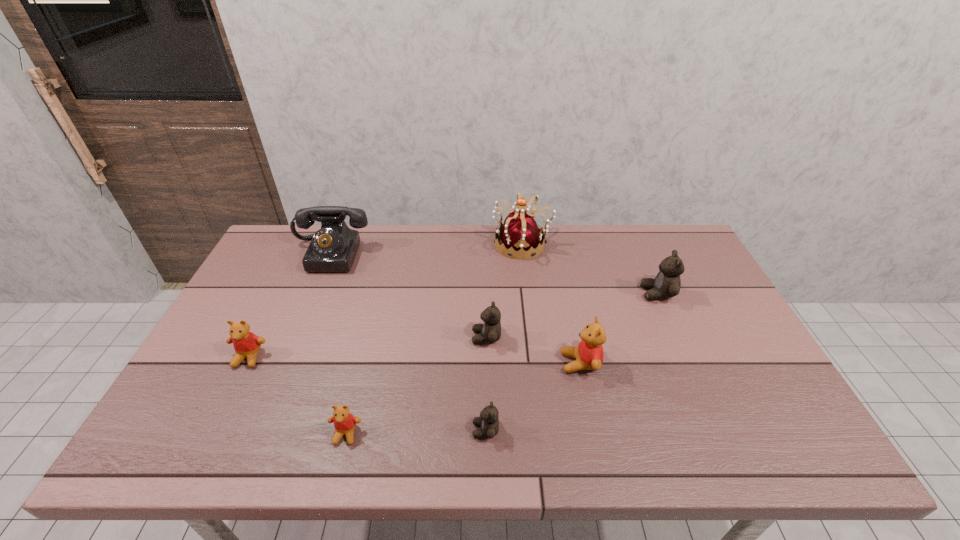
Image resolution: width=960 pixels, height=540 pixels. Identify the location of the nearest brown teddy bear. (488, 421).

Where is `the nearest red teddy bear`? This screenshot has width=960, height=540. the nearest red teddy bear is located at coordinates (344, 423).

In order to click on the smallest red teddy bear in this screenshot , I will do [x=344, y=423].

Find the location of a particular element. The width and height of the screenshot is (960, 540). vacant space located on the front-facing side of the tiara is located at coordinates (471, 244).

Locate an element on the screen. free region located on the front-facing side of the tiara is located at coordinates (414, 244).

Identify the location of vacant region located on the front-facing side of the tiara. (443, 244).

Where is `free space located on the dial of the black telephone`? The image size is (960, 540). free space located on the dial of the black telephone is located at coordinates (300, 328).

You are a GUI agent. You are given a task and a screenshot of the screen. Output one action in this format:
    pyautogui.click(x=<x>, y=<y>)
    Task: Click on the vacant space located 0.350m on the face of the rightmost object
    
    Given the screenshot: What is the action you would take?
    pyautogui.click(x=525, y=294)

You are a GUI agent. You are given a task and a screenshot of the screen. Output one action in this format:
    pyautogui.click(x=<x>, y=<y>)
    Task: Click on the blank area located 0.140m on the face of the rightmost object
    
    Given the screenshot: What is the action you would take?
    pyautogui.click(x=595, y=294)

Find the location of a particular element. free space located 0.130m on the face of the rightmost object is located at coordinates (598, 294).